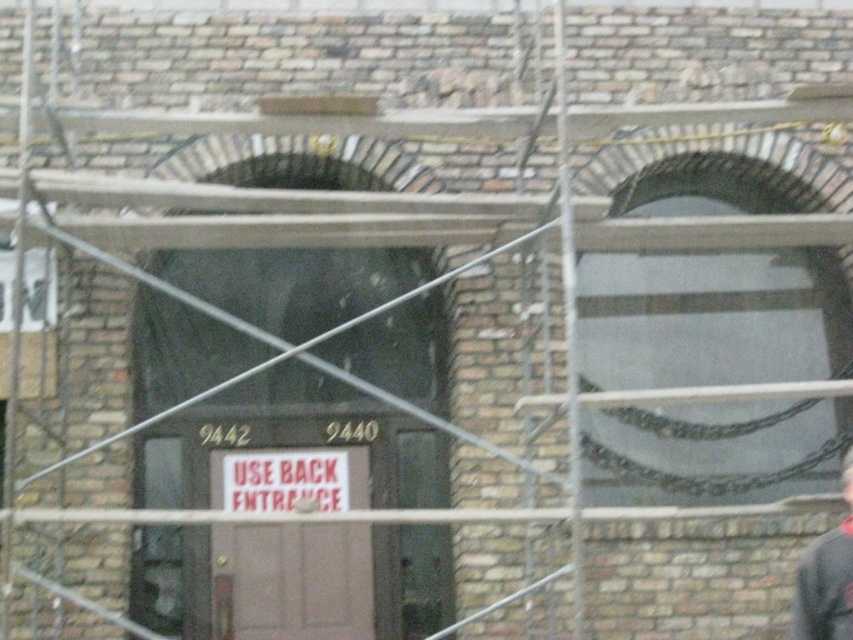
You are a delivery person who needs to access the building shown. The door has a sign saying to use the back entrance. However, you notice the metal scaffolding at right and the gray fabric construction worker at lower right. Which object is bigger in size?

The metal scaffolding at right is larger in size compared to the gray fabric construction worker at lower right.

You are a delivery person approaching the building with the brown matte door at center and a gray fabric construction worker at lower right. Which object is closer to you as you approach the building?

The brown matte door at center is closer to you because the gray fabric construction worker at lower right is behind it.